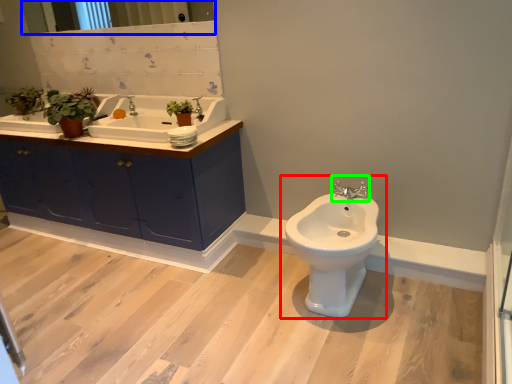
Question: Based on their relative distances, which object is farther from toilet (highlighted by a red box)? Choose from mirror (highlighted by a blue box) and tap (highlighted by a green box).

Choices:
 (A) mirror
 (B) tap

Answer: (A)